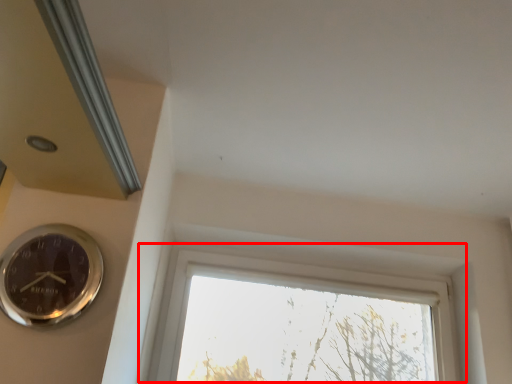
Question: Observing the image, what is the correct spatial positioning of window (annotated by the red box) in reference to wall clock?

Choices:
 (A) right
 (B) left

Answer: (A)